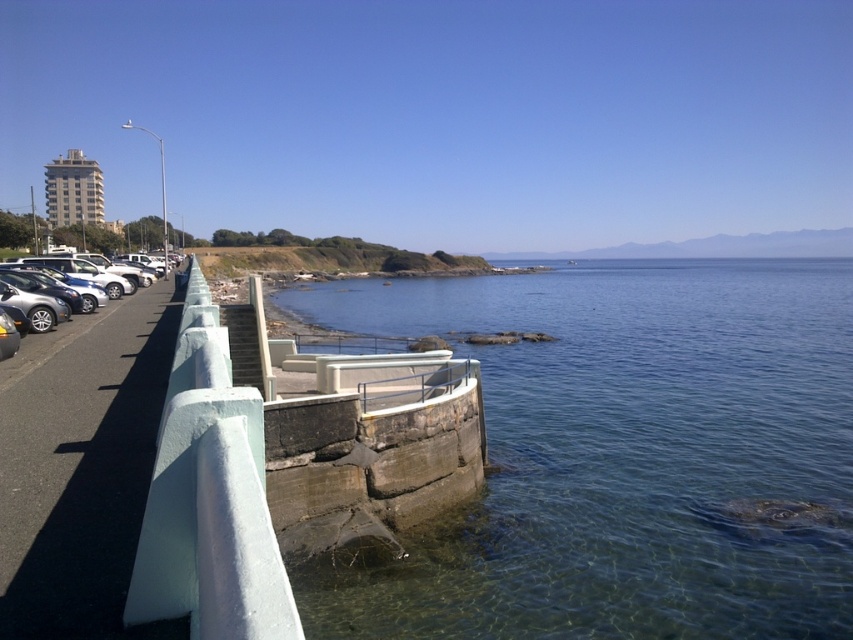
You are a photographer standing at the edge of the road near the concrete barrier. You want to capture a photo of the clear blue water at lower center and the matte silver sedan at left in the same frame. Based on their positions, which object will appear larger in the photo?

The clear blue water at lower center will appear larger in the photo because it is much taller than the matte silver sedan at left.

You are a visitor who just arrived at the coastal area and parked your car. You want to walk to the clear blue water at lower center from the matte silver sedan at left. Which direction should you head towards?

The clear blue water at lower center is positioned on the right side of matte silver sedan at left, so you should head towards the right direction from the matte silver sedan at left to reach the clear blue water at lower center.